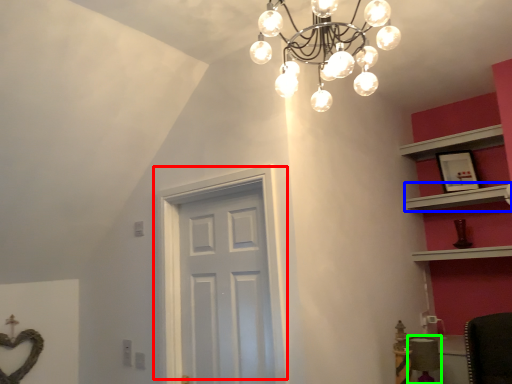
Question: Which object is the farthest from door (highlighted by a red box)? Choose among these: shelf (highlighted by a blue box) or chair (highlighted by a green box).

Choices:
 (A) shelf
 (B) chair

Answer: (A)